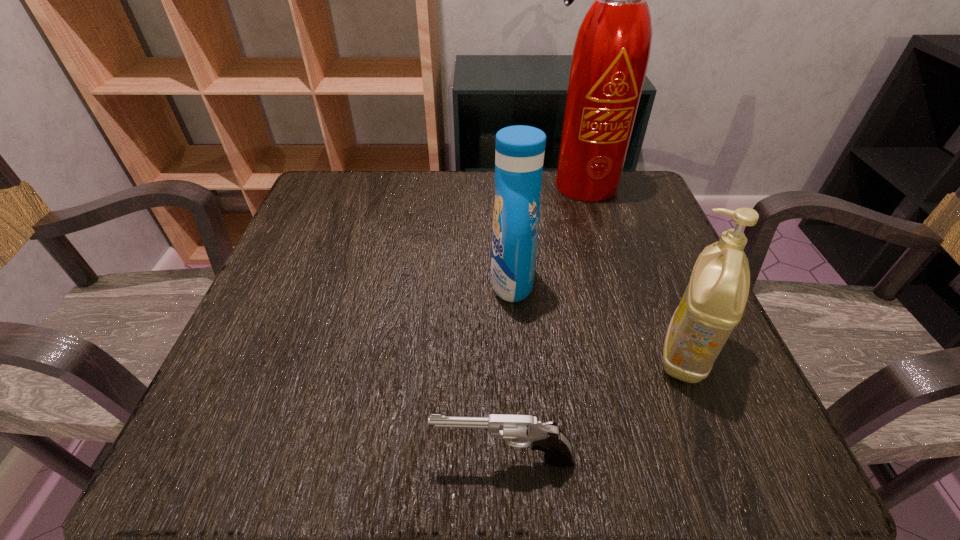
What are the coordinates of `free region located 0.240m on the front-facing side of the second tallest object` in the screenshot? It's located at (364, 281).

The height and width of the screenshot is (540, 960). Find the location of `blank space located on the front-facing side of the second tallest object`. blank space located on the front-facing side of the second tallest object is located at coordinates pyautogui.click(x=390, y=281).

You are a GUI agent. You are given a task and a screenshot of the screen. Output one action in this format:
    pyautogui.click(x=<x>, y=<y>)
    Task: Click on the free space located 0.180m on the left of the shorter detergent
    
    Given the screenshot: What is the action you would take?
    pyautogui.click(x=540, y=353)

Locate an element on the screen. This screenshot has width=960, height=540. vacant space located at the muzzle of the gun is located at coordinates (382, 458).

Locate an element on the screen. Image resolution: width=960 pixels, height=540 pixels. free region located 0.090m at the muzzle of the gun is located at coordinates (367, 458).

This screenshot has height=540, width=960. Find the location of `blank space located 0.050m at the muzzle of the gun`. blank space located 0.050m at the muzzle of the gun is located at coordinates (396, 458).

The image size is (960, 540). I want to click on object that is at the far edge, so click(611, 53).

Identify the location of object located in the near edge section of the desktop. (547, 437).

Locate an element on the screen. fire extinguisher that is at the right edge is located at coordinates (611, 53).

This screenshot has width=960, height=540. Find the location of `detergent present at the right edge`. detergent present at the right edge is located at coordinates (714, 301).